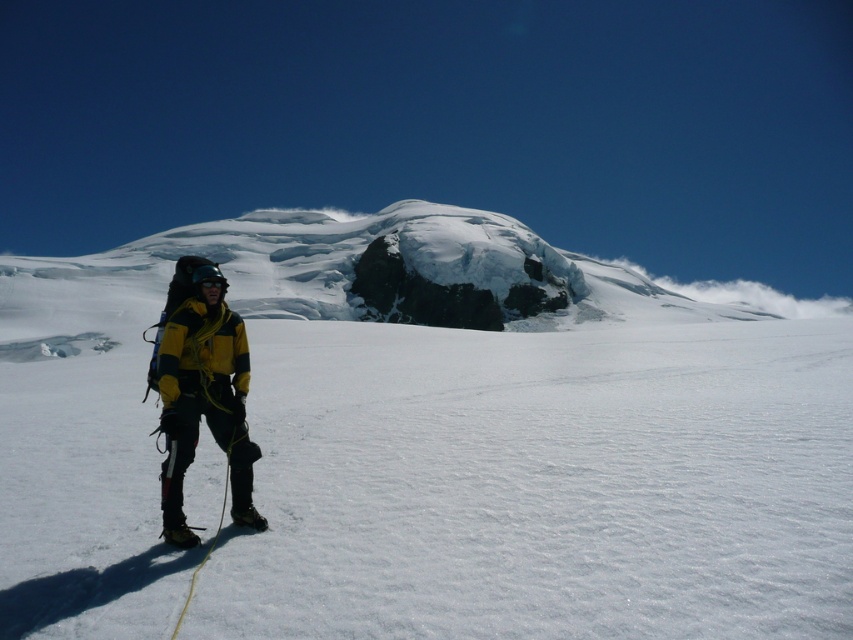
Between point (691, 600) and point (241, 476), which one is positioned behind?

The point (241, 476) is more distant.

Does white powder snow at center have a lesser width compared to yellow fabric jacket at left?

No.

Is point (697, 486) positioned in front of point (160, 380)?

No, (697, 486) is further to viewer.

What are the coordinates of `white powder snow at center` in the screenshot? It's located at (428, 442).